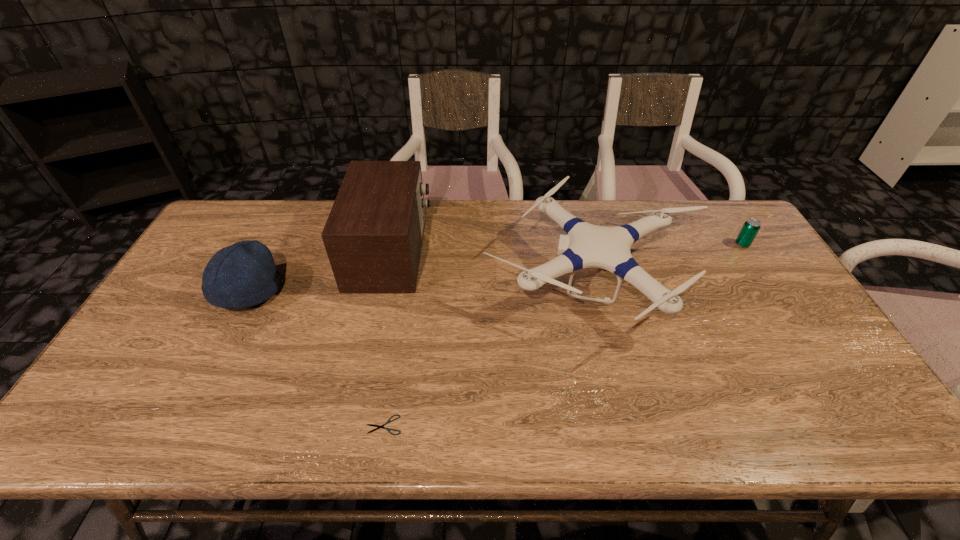
Locate an element on the screen. The image size is (960, 540). vacant region between the tallest object and the drone is located at coordinates (492, 266).

This screenshot has width=960, height=540. I want to click on vacant area between the fourth tallest object and the fourth object from left to right, so click(668, 262).

This screenshot has width=960, height=540. Find the location of `unoccupied area between the third shortest object and the shortest object`. unoccupied area between the third shortest object and the shortest object is located at coordinates (316, 359).

Identify which object is the nearest to the rightmost object. Please provide its 2D coordinates. Your answer should be formatted as a tuple, i.e. [(x, y)], where the tuple contains the x and y coordinates of a point satisfying the conditions above.

[(586, 245)]

You are a GUI agent. You are given a task and a screenshot of the screen. Output one action in this format:
    pyautogui.click(x=<x>, y=<y>)
    Task: Click on the third closest object to the drone
    The image size is (960, 540).
    Given the screenshot: What is the action you would take?
    pyautogui.click(x=378, y=426)

Identify the location of vacant space that satisfies the following two spatial constraints: 1. on the front-facing side of the tallest object; 2. on the right side of the second object from right to left. This screenshot has width=960, height=540. (385, 280).

Find the location of a particular element. Image resolution: width=960 pixels, height=540 pixels. free space that satisfies the following two spatial constraints: 1. on the front-facing side of the tallest object; 2. on the back side of the drone is located at coordinates [385, 280].

I want to click on vacant space that satisfies the following two spatial constraints: 1. on the front-facing side of the second object from right to left; 2. on the right side of the tallest object, so click(x=385, y=280).

The width and height of the screenshot is (960, 540). What are the coordinates of `vacant space that satisfies the following two spatial constraints: 1. on the front side of the beer can; 2. on the front-facing side of the radio receiver` in the screenshot? It's located at (747, 252).

The width and height of the screenshot is (960, 540). What are the coordinates of `vacant space that satisfies the following two spatial constraints: 1. on the front-facing side of the radio receiver; 2. on the back side of the shears` in the screenshot? It's located at (353, 425).